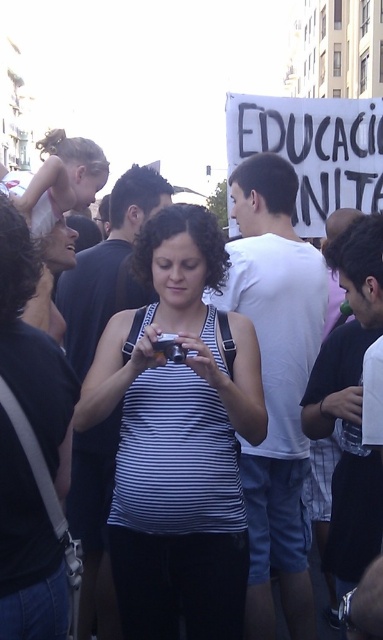
Question: Is white striped tank top at center smaller than white cotton shirt at center?

Choices:
 (A) yes
 (B) no

Answer: (A)

Question: Which point is closer to the camera taking this photo?

Choices:
 (A) (248, 188)
 (B) (106, 372)

Answer: (B)

Question: Can you confirm if white striped tank top at center is thinner than white cotton shirt at center?

Choices:
 (A) yes
 (B) no

Answer: (B)

Question: From the image, what is the correct spatial relationship of white striped tank top at center in relation to white cotton shirt at center?

Choices:
 (A) below
 (B) above

Answer: (A)

Question: Which of the following is the farthest from the observer?

Choices:
 (A) white cotton shirt at center
 (B) white striped tank top at center

Answer: (A)

Question: Which object appears farthest from the camera in this image?

Choices:
 (A) white cotton shirt at center
 (B) white striped tank top at center

Answer: (A)